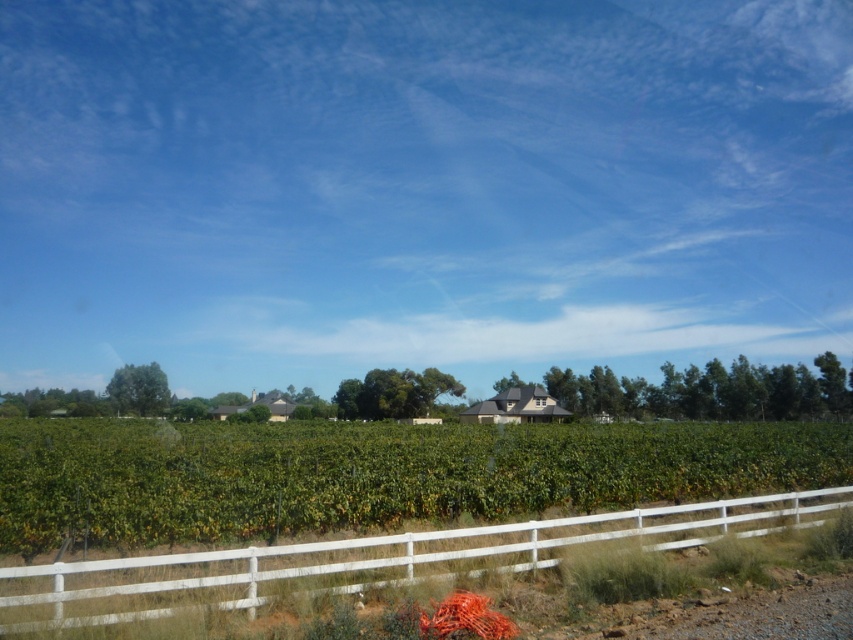
How much distance is there between green leafy vineyard at center and white wooden fence at lower center?

61.26 feet

This screenshot has height=640, width=853. Describe the element at coordinates (373, 474) in the screenshot. I see `green leafy vineyard at center` at that location.

The image size is (853, 640). What do you see at coordinates (373, 474) in the screenshot?
I see `green leafy vineyard at center` at bounding box center [373, 474].

Identify the location of green leafy vineyard at center. The width and height of the screenshot is (853, 640). (373, 474).